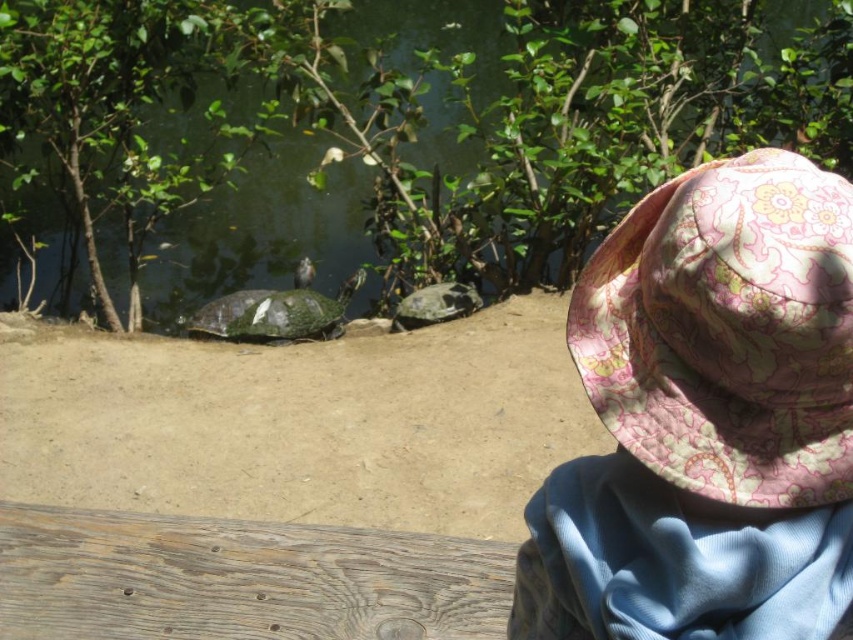
Which is in front, point (309, 298) or point (419, 301)?

Point (419, 301) is more forward.

Where is `green scaly tortoise at center`? Image resolution: width=853 pixels, height=640 pixels. green scaly tortoise at center is located at coordinates (276, 314).

Does point (717, 460) come closer to viewer compared to point (250, 339)?

That is True.

The height and width of the screenshot is (640, 853). I want to click on floral fabric sunhat at upper right, so click(x=727, y=332).

Between point (604, 406) and point (399, 307), which one is positioned in front?

Point (604, 406) is more forward.

The image size is (853, 640). Describe the element at coordinates (727, 332) in the screenshot. I see `floral fabric sunhat at upper right` at that location.

Is point (822, 374) positioned behind point (459, 308)?

That is False.

You are a GUI agent. You are given a task and a screenshot of the screen. Output one action in this format:
    pyautogui.click(x=<x>, y=<y>)
    Task: Click on the floral fabric sunhat at upper right
    The image size is (853, 640).
    Given the screenshot: What is the action you would take?
    pyautogui.click(x=727, y=332)